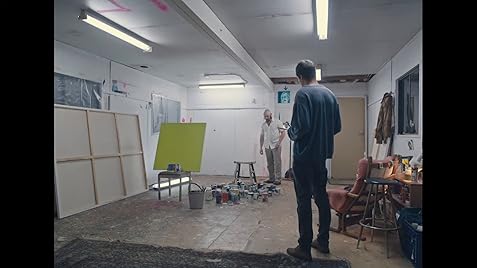
Locate an element on the screen. The image size is (477, 268). table is located at coordinates tap(100, 159).